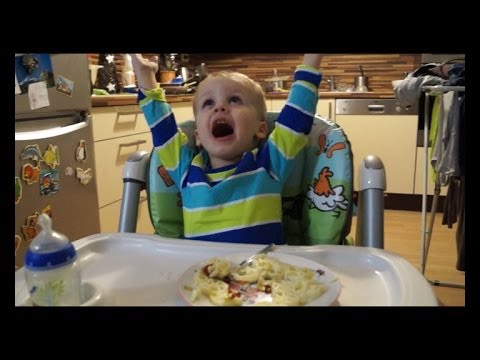
Where is `backrest`? Image resolution: width=480 pixels, height=360 pixels. backrest is located at coordinates (336, 192).